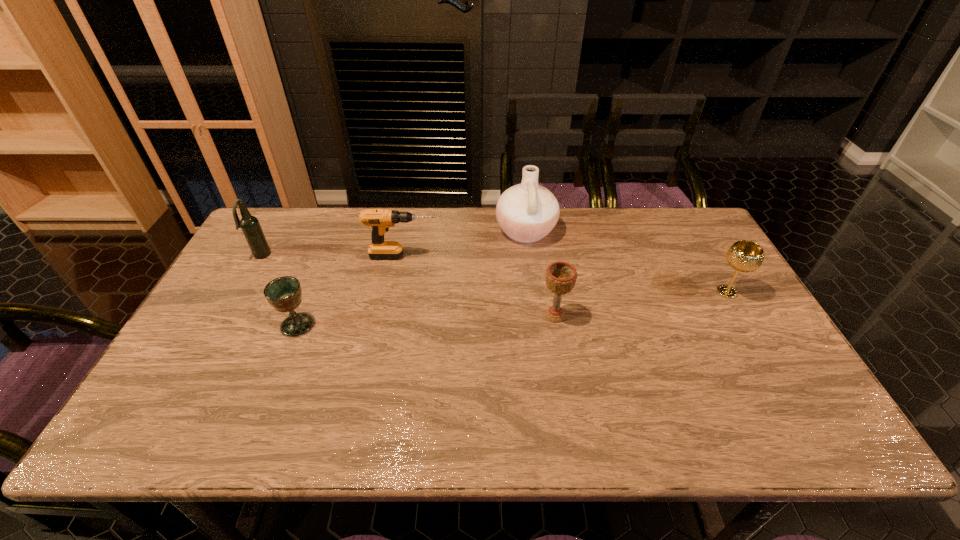
Locate an element on the screen. vacant area located 0.400m to pour from the handle of the pottery is located at coordinates [376, 231].

Image resolution: width=960 pixels, height=540 pixels. In order to click on vacant space located on the front of the leftmost object in this screenshot , I will do coord(222,327).

Locate an element on the screen. The width and height of the screenshot is (960, 540). vacant space located 0.360m at the tip of the third object from left to right is located at coordinates (553, 256).

Identify the location of free location located 0.350m on the left of the second chalice from right to left. (413, 316).

Where is `vacant space situated on the front of the farthest chalice`? vacant space situated on the front of the farthest chalice is located at coordinates (796, 412).

You are a GUI agent. You are given a task and a screenshot of the screen. Output one action in this format:
    pyautogui.click(x=<x>, y=<y>)
    Task: Click on the free location located 0.260m on the front of the leftmost chalice
    The image size is (960, 540).
    Given the screenshot: What is the action you would take?
    pyautogui.click(x=255, y=430)

Find the location of a particular element. pottery that is at the far edge is located at coordinates pos(527,212).

Where is `beer bottle present at the far edge`? beer bottle present at the far edge is located at coordinates (251, 228).

You are a GUI agent. You are given a task and a screenshot of the screen. Output one action in this format:
    pyautogui.click(x=<x>, y=<y>)
    Task: Click on the object located in the left edge section of the desktop
    
    Given the screenshot: What is the action you would take?
    pyautogui.click(x=251, y=228)

You are a GUI agent. You are given a task and a screenshot of the screen. Output one action in this format:
    pyautogui.click(x=<x>, y=<y>)
    Task: Click on the object situated at the right edge
    The image size is (960, 540).
    Given the screenshot: What is the action you would take?
    pyautogui.click(x=744, y=256)